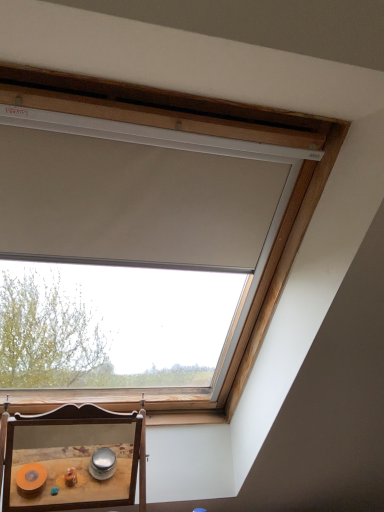
Question: Should I look upward or downward to see wooden table at lower left?

Choices:
 (A) up
 (B) down

Answer: (B)